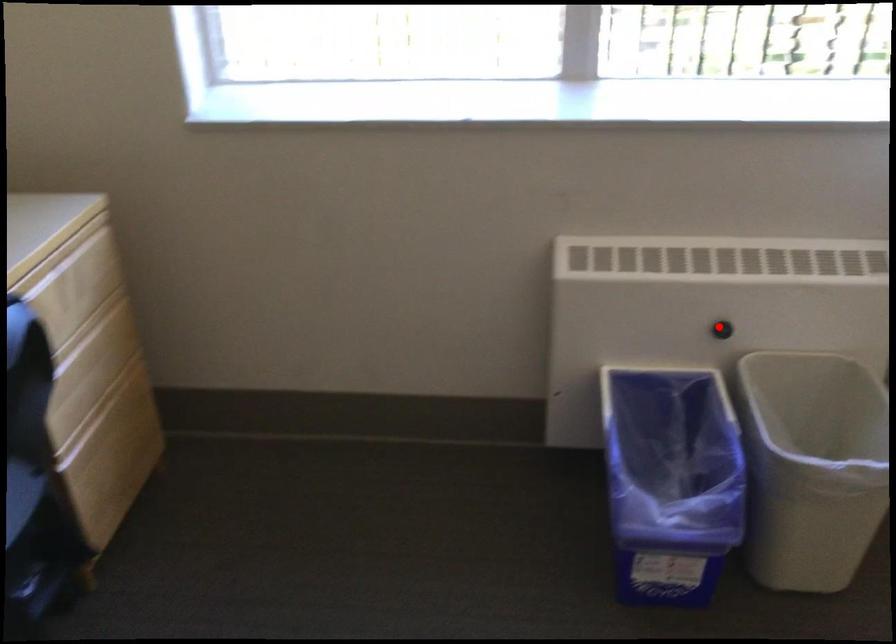
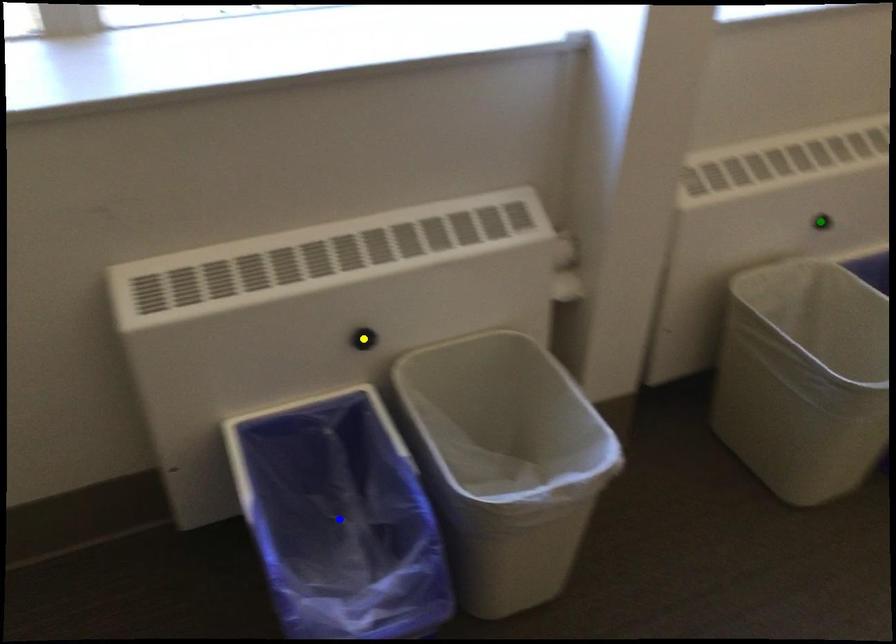
Question: I am providing you with two images of the same scene from different viewpoints. A red point is marked on the first image. You are given multiple points on the second image. Which point in image 2 represents the same 3d spot as the red point in image 1?

Choices:
 (A) blue point
 (B) yellow point
 (C) green point

Answer: (B)